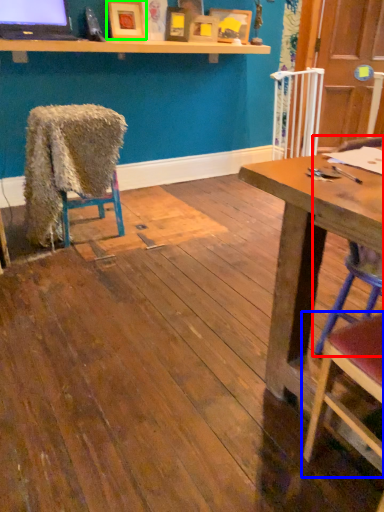
Question: Which is farther away from chair (highlighted by a red box)? chair (highlighted by a blue box) or picture frame (highlighted by a green box)?

Choices:
 (A) chair
 (B) picture frame

Answer: (B)